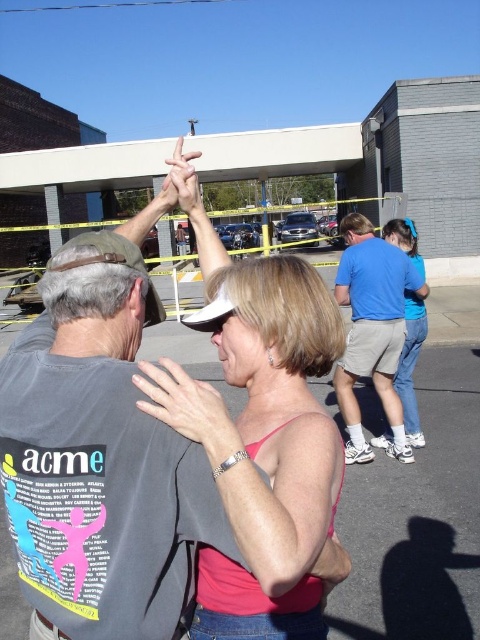
Between point (403, 291) and point (168, 161), which one is positioned behind?

The point (403, 291) is behind.

Between blue cotton shirt at center and matte white hand at center, which one is positioned higher?

Positioned higher is matte white hand at center.

Locate an element on the screen. blue cotton shirt at center is located at coordinates (372, 330).

Which is more to the right, pink fabric top at center or matte white hand at center?

pink fabric top at center

Find the location of a particular element. The height and width of the screenshot is (640, 480). pink fabric top at center is located at coordinates (264, 442).

Is point (269, 428) in front of point (187, 170)?

That is True.

In order to click on pink fabric top at center in this screenshot , I will do `click(264, 442)`.

Between pink matte tank top at center and blue cotton shirt at center, which one is positioned higher?

blue cotton shirt at center is higher up.

Is point (128, 492) positioned before point (370, 225)?

Yes, point (128, 492) is closer to viewer.

Which is in front, point (87, 468) or point (359, 346)?

Point (87, 468)

What are the coordinates of `pink matte tank top at center` in the screenshot? It's located at (99, 454).